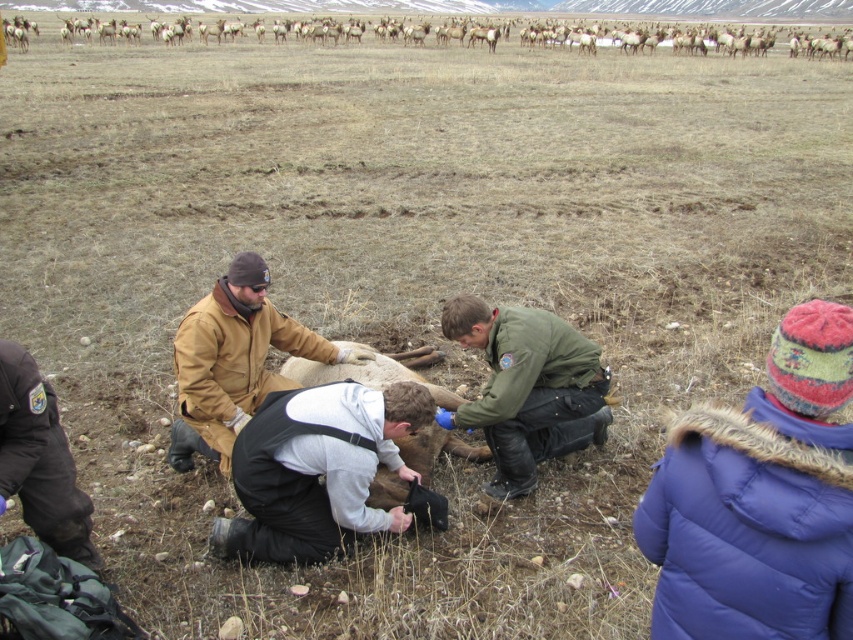
You are a photographer trying to capture a group photo of the two people near the animal. You want to arrange them so that the person in the purple fuzzy coat at lower right is on the right side of the person in the brown leather jacket at center. Is this already the case in the current arrangement?

Yes, the purple fuzzy coat at lower right is already positioned on the right side of the brown leather jacket at center, so the current arrangement meets your requirement.

You are a wildlife photographer observing the scene. You notice the brown leather jacket at center and the brown fur at upper center. Which object is positioned to the left of the other?

The brown leather jacket at center is to the left of brown fur at upper center.

You are a hiker who needs to decide which item to use for warmth between the purple fuzzy coat at lower right and the brown fur at upper center. Based on their thickness, which one would be better for staying warm?

The brown fur at upper center is thicker than the purple fuzzy coat at lower right, so it would provide better warmth.